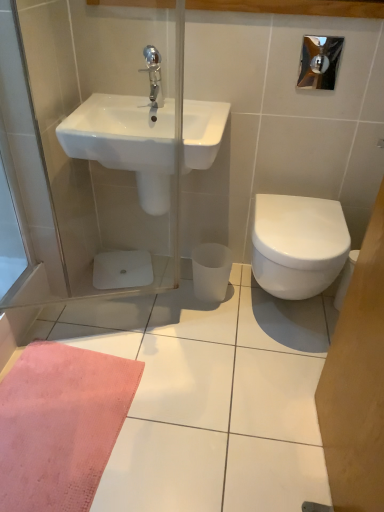
Identify the location of vacant area located to the right-hand side of chrome metallic faucet at upper center. This screenshot has height=512, width=384. (198, 108).